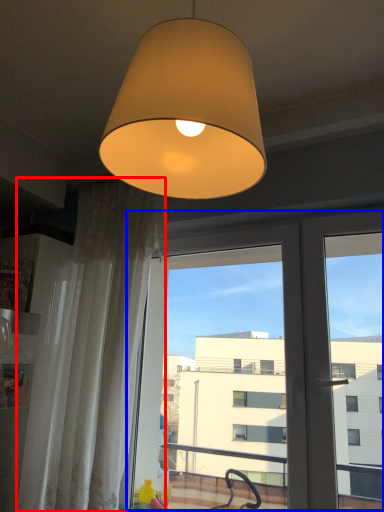
Question: Which object is further to the camera taking this photo, curtain (highlighted by a red box) or screen door (highlighted by a blue box)?

Choices:
 (A) curtain
 (B) screen door

Answer: (A)